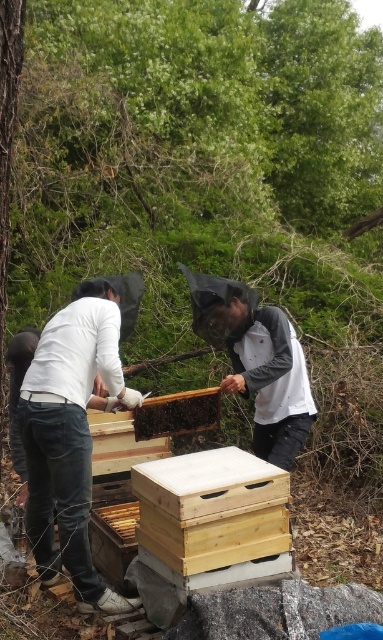
Does white matte shirt at center have a smaller size compared to white fabric beekeeper suit at center?

Actually, white matte shirt at center might be larger than white fabric beekeeper suit at center.

Can you confirm if white matte shirt at center is positioned above white fabric beekeeper suit at center?

No, white matte shirt at center is not above white fabric beekeeper suit at center.

Is point (108, 314) in front of point (243, 362)?

Yes, it is.

This screenshot has height=640, width=383. I want to click on white matte shirt at center, so click(70, 436).

Can you confirm if white matte shirt at center is positioned below wooden beehive at center?

Correct, white matte shirt at center is located below wooden beehive at center.

Is point (29, 486) farther from viewer compared to point (134, 426)?

No.

At what (x,y) coordinates should I click in order to perform the action: click on white matte shirt at center. Please return your answer as a coordinate pair (x, y). This screenshot has width=383, height=640. Looking at the image, I should click on (70, 436).

Does point (268, 515) come in front of point (212, 424)?

Yes, it is.

Is point (278, 545) farther from camera compared to point (176, 408)?

No, it is not.

Locate an element on the screen. This screenshot has width=383, height=640. light wood beehive at center is located at coordinates (212, 513).